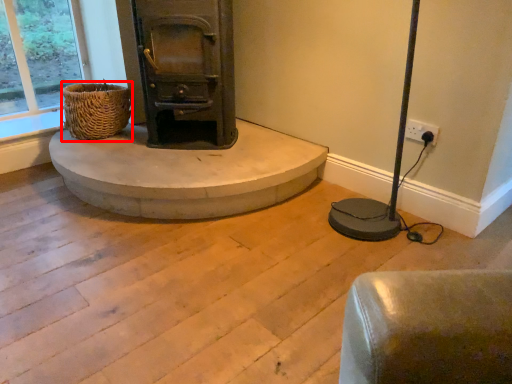
Question: Considering the relative positions of basket (annotated by the red box) and concrete in the image provided, where is basket (annotated by the red box) located with respect to the staircase?

Choices:
 (A) right
 (B) left

Answer: (B)